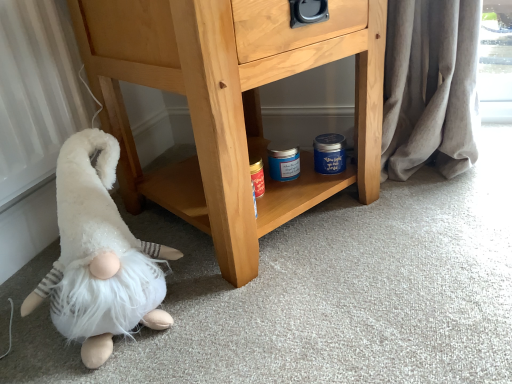
Question: From the image's perspective, is white fluffy gnome at lower left above or below light brown wood chest of drawers at center?

Choices:
 (A) above
 (B) below

Answer: (B)

Question: Considering the positions of white fluffy gnome at lower left and light brown wood chest of drawers at center in the image, is white fluffy gnome at lower left taller or shorter than light brown wood chest of drawers at center?

Choices:
 (A) tall
 (B) short

Answer: (B)

Question: Is white fluffy gnome at lower left bigger or smaller than light brown wood chest of drawers at center?

Choices:
 (A) small
 (B) big

Answer: (A)

Question: Considering their positions, is light brown wood chest of drawers at center located in front of or behind white fluffy gnome at lower left?

Choices:
 (A) front
 (B) behind

Answer: (B)

Question: Based on their sizes in the image, would you say light brown wood chest of drawers at center is bigger or smaller than white fluffy gnome at lower left?

Choices:
 (A) small
 (B) big

Answer: (B)

Question: From the image's perspective, relative to white fluffy gnome at lower left, is light brown wood chest of drawers at center above or below?

Choices:
 (A) above
 (B) below

Answer: (A)

Question: Is light brown wood chest of drawers at center taller or shorter than white fluffy gnome at lower left?

Choices:
 (A) tall
 (B) short

Answer: (A)